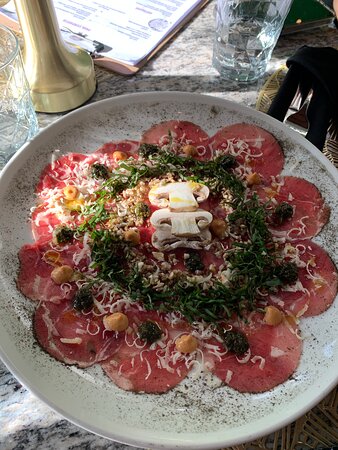
Where is `clipboard`? This screenshot has width=338, height=450. clipboard is located at coordinates (126, 67).